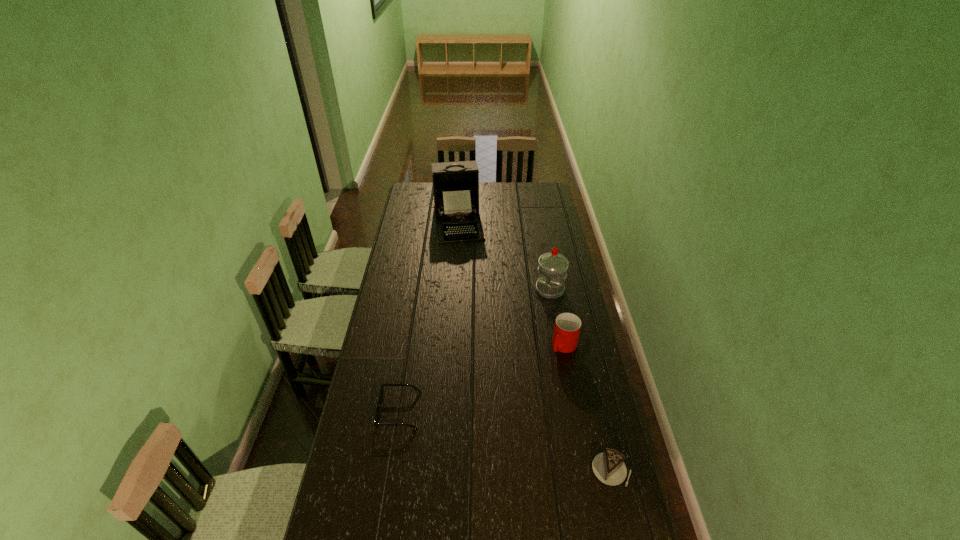
The width and height of the screenshot is (960, 540). What are the coordinates of `blank space at the far right corner of the desktop` in the screenshot? It's located at (554, 201).

The height and width of the screenshot is (540, 960). Identify the location of free area in between the third farthest object and the sunglasses. pos(482,378).

Where is `unoccupied area between the third tallest object and the typewriter`? This screenshot has height=540, width=960. unoccupied area between the third tallest object and the typewriter is located at coordinates (511, 283).

Identify the location of vacant area between the third nearest object and the fourth tallest object. (588, 408).

Image resolution: width=960 pixels, height=540 pixels. I want to click on blank region between the typewriter and the third nearest object, so pos(511,283).

At what (x,y) coordinates should I click in order to perform the action: click on blank region between the fourth tallest object and the shortest object. Please return your answer as a coordinate pair (x, y). Looking at the image, I should click on [505, 440].

Locate an element on the screen. The height and width of the screenshot is (540, 960). free space between the typewriter and the cup is located at coordinates (511, 283).

Locate an element on the screen. Image resolution: width=960 pixels, height=540 pixels. free area in between the cup and the farthest object is located at coordinates (511, 283).

I want to click on free space between the third farthest object and the second nearest object, so click(482, 378).

I want to click on free spot between the fourth shortest object and the farthest object, so click(x=504, y=255).